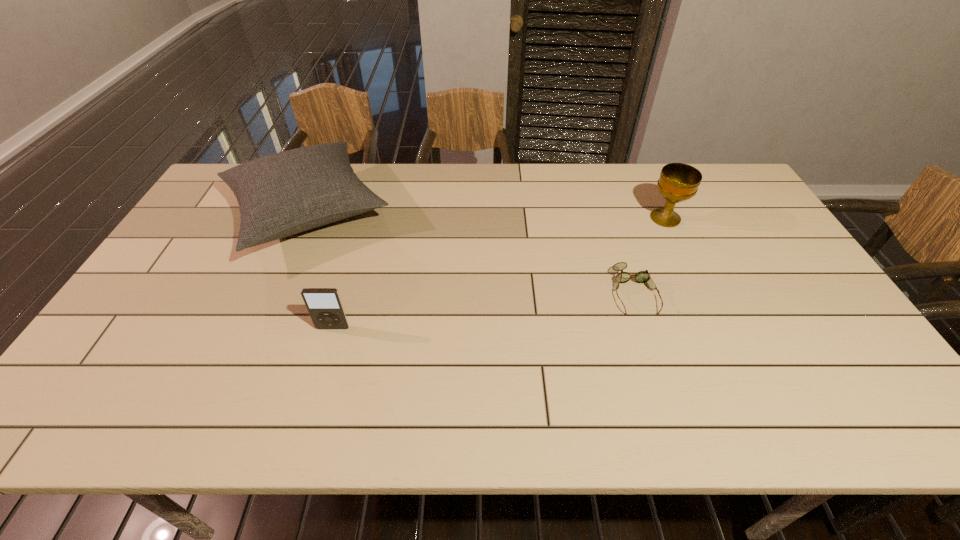
Image resolution: width=960 pixels, height=540 pixels. I want to click on object at the far edge, so click(x=279, y=195).

I want to click on object positioned at the left edge, so click(279, 195).

At what (x,y) coordinates should I click in order to perform the action: click on object present at the far left corner. Please return your answer as a coordinate pair (x, y). The height and width of the screenshot is (540, 960). Looking at the image, I should click on (279, 195).

I want to click on vacant area at the far edge of the desktop, so click(x=553, y=167).

What are the coordinates of `free spot at the left edge of the desktop` in the screenshot? It's located at (115, 362).

Locate an element on the screen. This screenshot has height=540, width=960. free space at the near right corner of the desktop is located at coordinates (872, 412).

The width and height of the screenshot is (960, 540). What are the coordinates of `vacant point located between the nearest object and the second object from right to left` in the screenshot? It's located at (484, 310).

Where is `vacant area between the rightmost object and the second shortest object`? This screenshot has width=960, height=540. vacant area between the rightmost object and the second shortest object is located at coordinates (499, 273).

Locate an element on the screen. The width and height of the screenshot is (960, 540). vacant area that lies between the rightmost object and the nearest object is located at coordinates (499, 273).

This screenshot has height=540, width=960. I want to click on free point between the chalice and the second object from right to left, so click(x=650, y=255).